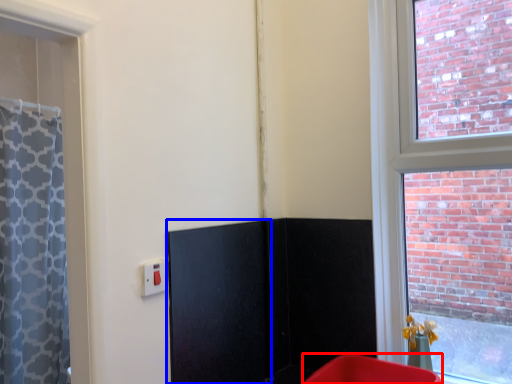
Question: Among these objects, which one is farthest to the camera, furniture (highlighted by a red box) or screen door (highlighted by a blue box)?

Choices:
 (A) furniture
 (B) screen door

Answer: (B)